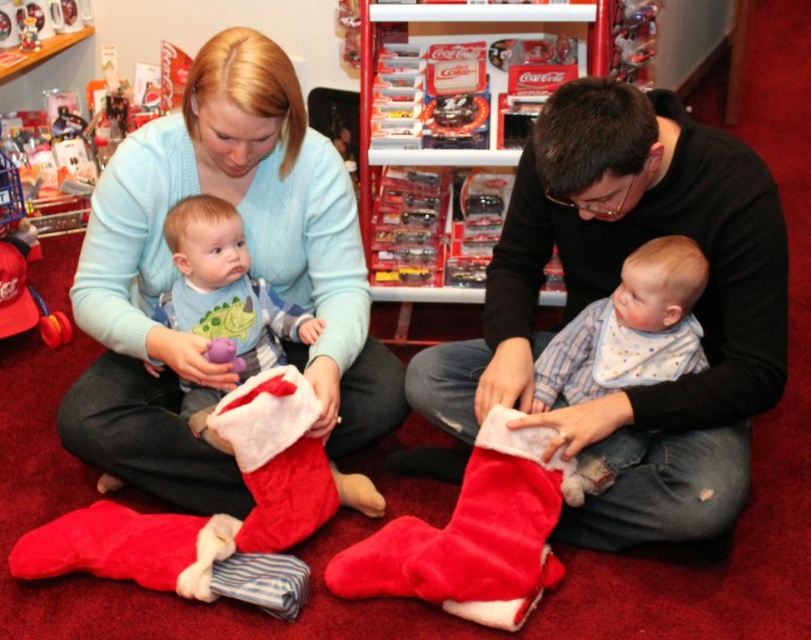
Can you confirm if velvet red stocking at lower center is taller than matte blue sweater at upper left?

No.

Is velvet red stocking at lower center to the right of matte blue sweater at upper left from the viewer's perspective?

Indeed, velvet red stocking at lower center is positioned on the right side of matte blue sweater at upper left.

Which is behind, point (715, 243) or point (101, 230)?

The point (101, 230) is behind.

I want to click on velvet red stocking at lower center, so click(610, 292).

Between velvet red stocking at lower center and matte purple plush toy at center, which one has more height?

Standing taller between the two is velvet red stocking at lower center.

Who is higher up, velvet red stocking at lower center or matte purple plush toy at center?

velvet red stocking at lower center is above.

Does point (569, 275) come behind point (213, 360)?

Yes, it is.

Find the location of a particular element. velvet red stocking at lower center is located at coordinates (610, 292).

Does matte plush baby at center appear on the left side of matte purple plush toy at center?

No, matte plush baby at center is not to the left of matte purple plush toy at center.

Which is more to the left, matte plush baby at center or matte purple plush toy at center?

matte purple plush toy at center

Where is `matte plush baby at center`? matte plush baby at center is located at coordinates (225, 285).